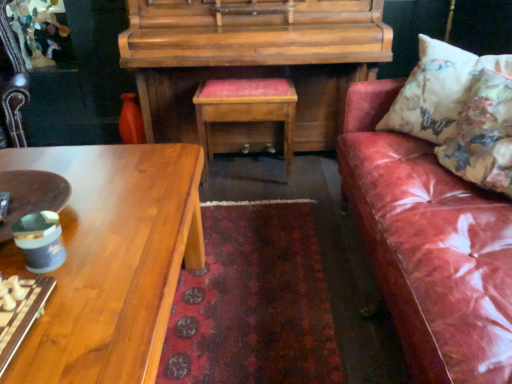
Question: Is shiny wood coffee table at lower left situated inside floral fabric cushion at right, which ranks as the 1th pillow in front-to-back order, or outside?

Choices:
 (A) inside
 (B) outside

Answer: (B)

Question: In terms of width, does shiny wood coffee table at lower left look wider or thinner when compared to floral fabric cushion at right, placed as the second pillow when sorted from back to front?

Choices:
 (A) thin
 (B) wide

Answer: (B)

Question: Considering the real-world distances, which object is farthest from the matte brown bowl at left?

Choices:
 (A) leather couch at right
 (B) woodenwoodentable at center
 (C) floral fabric cushion at right, which ranks as the 1th pillow in front-to-back order
 (D) shiny wood coffee table at lower left
 (E) wooden piano at center

Answer: (C)

Question: Which of these objects is positioned closest to the floral fabric cushion at right, which ranks as the 1th pillow in front-to-back order?

Choices:
 (A) wooden piano at center
 (B) leather couch at right
 (C) floral fabric cushion at right, marked as the 2th pillow in a front-to-back arrangement
 (D) woodenwoodentable at center
 (E) shiny wood coffee table at lower left

Answer: (C)